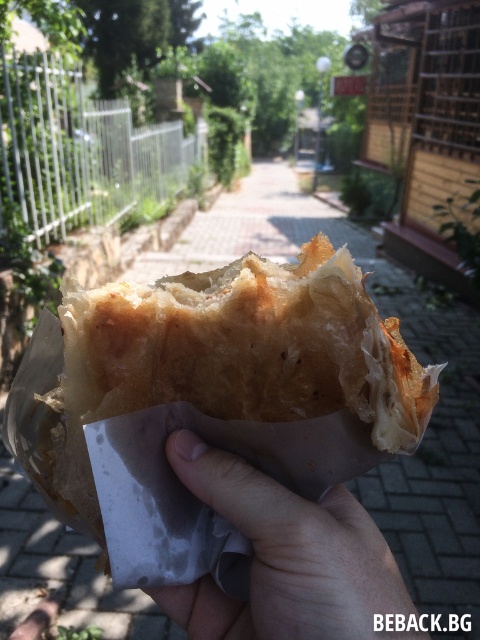
Between golden crispy pastry at center and light skin textured hand at center, which one appears on the right side from the viewer's perspective?

light skin textured hand at center

Is golden crispy pastry at center to the right of light skin textured hand at center from the viewer's perspective?

No, golden crispy pastry at center is not to the right of light skin textured hand at center.

The height and width of the screenshot is (640, 480). Find the location of `golden crispy pastry at center`. golden crispy pastry at center is located at coordinates (235, 355).